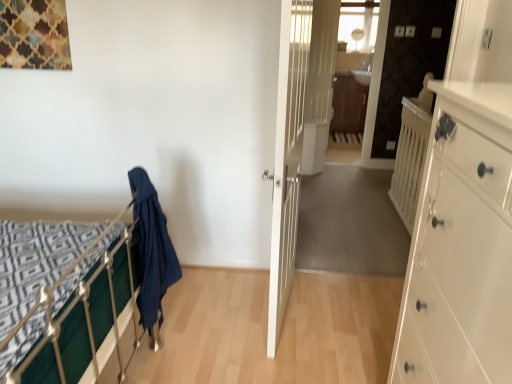
You are a GUI agent. You are given a task and a screenshot of the screen. Output one action in this format:
    pyautogui.click(x=<x>, y=<y>)
    Task: Click on the free space to the right of white wooden door at center, which is the second door in back-to-front order
    
    Given the screenshot: What is the action you would take?
    pyautogui.click(x=341, y=306)